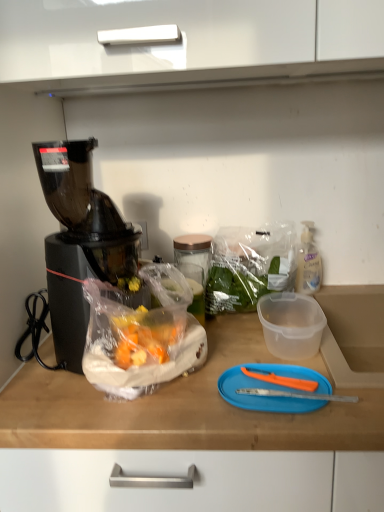
Identify the location of vacant region to the right of clear plastic bottle at right. The image size is (384, 512). (350, 291).